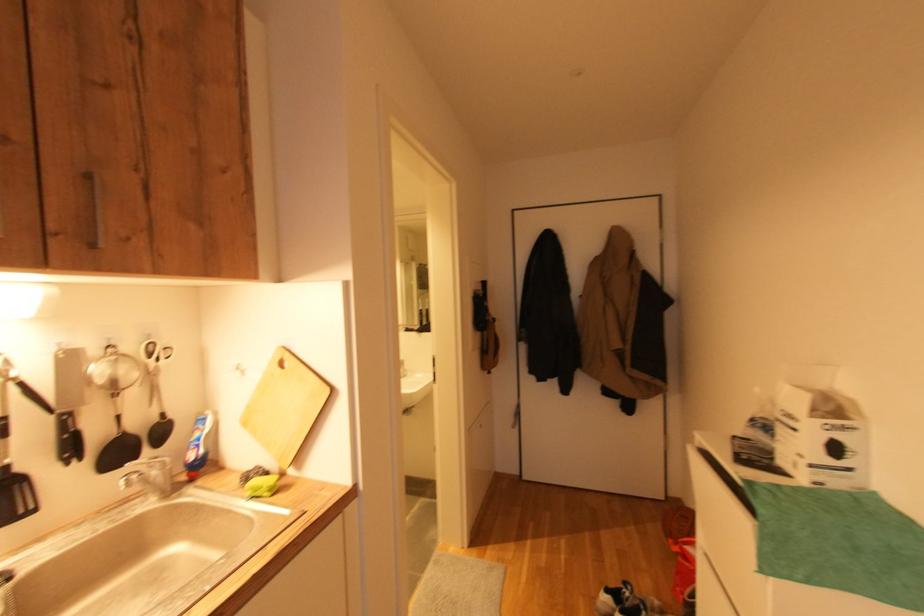
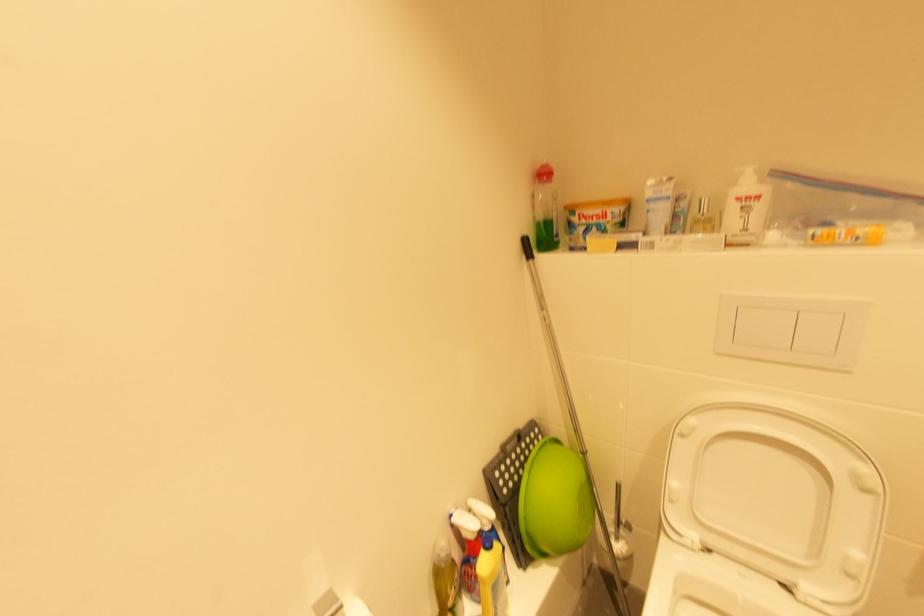
The images are taken continuously from a first-person perspective. In which direction are you moving?

The cameraman moved toward left, forward.